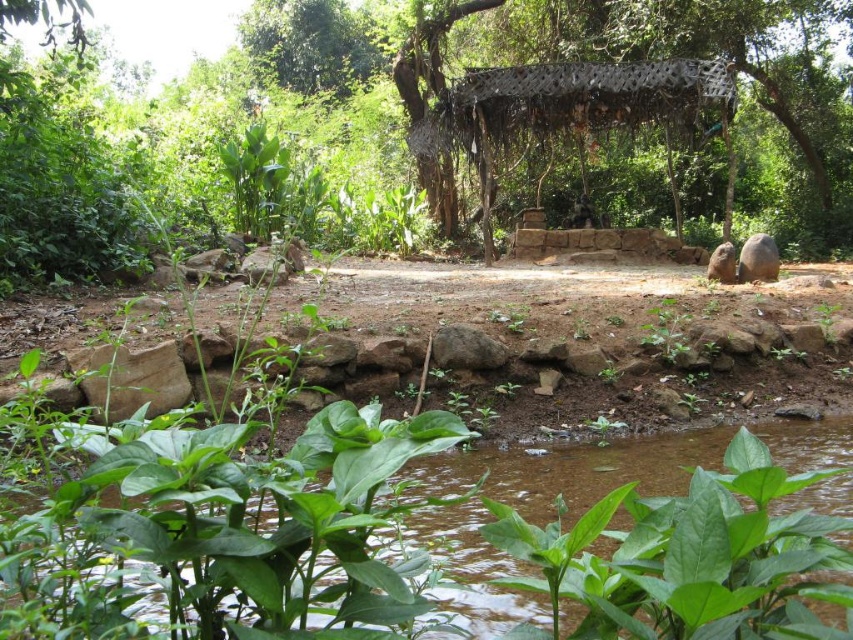
Between green leafy water at bottom and rusty metal canopy at center, which one is positioned lower?

green leafy water at bottom is below.

In the scene shown: Is green leafy water at bottom wider than rusty metal canopy at center?

Incorrect, green leafy water at bottom's width does not surpass rusty metal canopy at center's.

Image resolution: width=853 pixels, height=640 pixels. What do you see at coordinates (225, 538) in the screenshot?
I see `green leafy water at bottom` at bounding box center [225, 538].

Find the location of a particular element. The height and width of the screenshot is (640, 853). green leafy water at bottom is located at coordinates (225, 538).